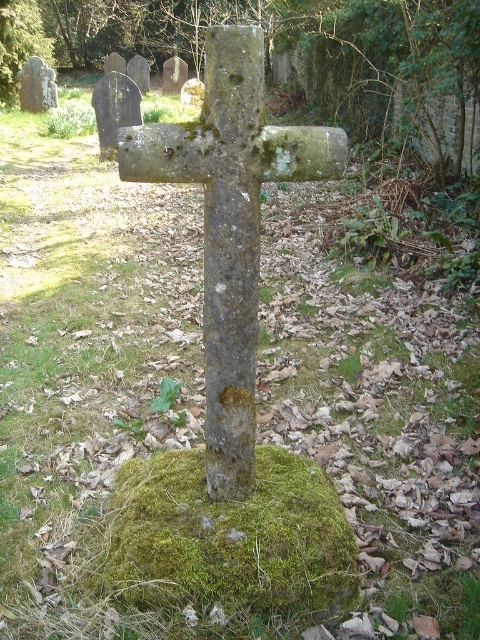
Question: Is green mossy cross at center to the right of green mossy stone cross at center from the viewer's perspective?

Choices:
 (A) yes
 (B) no

Answer: (B)

Question: Does green mossy cross at center have a greater width compared to green mossy stone cross at center?

Choices:
 (A) no
 (B) yes

Answer: (B)

Question: Is green mossy cross at center further to camera compared to green mossy stone cross at center?

Choices:
 (A) yes
 (B) no

Answer: (A)

Question: Among these objects, which one is farthest from the camera?

Choices:
 (A) green mossy stone cross at center
 (B) green mossy cross at center

Answer: (B)

Question: Among these points, which one is nearest to the camera?

Choices:
 (A) (235, 269)
 (B) (128, 44)

Answer: (A)